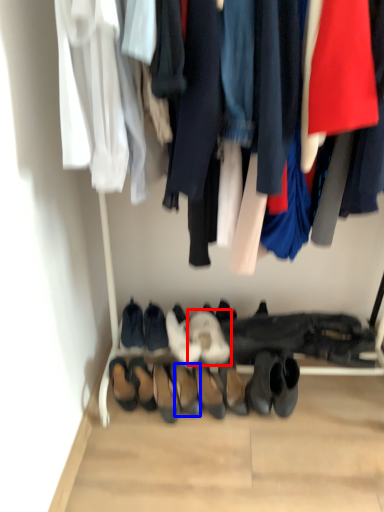
Question: Which object is closer to the camera taking this photo, footwear (highlighted by a red box) or footwear (highlighted by a blue box)?

Choices:
 (A) footwear
 (B) footwear

Answer: (B)